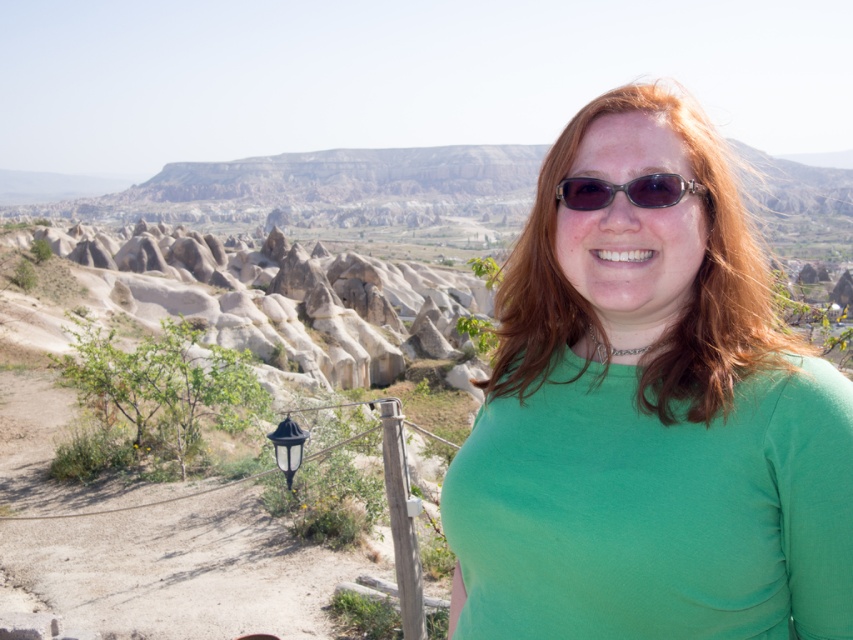
Which is below, green matte shirt at center or brown textured sunglasses at center?

Positioned lower is green matte shirt at center.

Where is `green matte shirt at center`? The height and width of the screenshot is (640, 853). green matte shirt at center is located at coordinates (648, 416).

You are a GUI agent. You are given a task and a screenshot of the screen. Output one action in this format:
    pyautogui.click(x=<x>, y=<y>)
    Task: Click on the green matte shirt at center
    This screenshot has width=853, height=640.
    Given the screenshot: What is the action you would take?
    pyautogui.click(x=648, y=416)